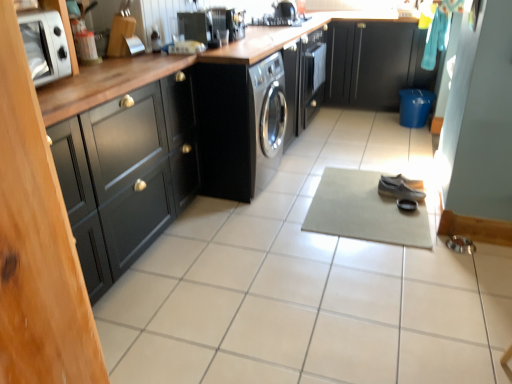
Where is `silver metallic microwave at upper left`? The height and width of the screenshot is (384, 512). silver metallic microwave at upper left is located at coordinates (45, 46).

Where is `leather shoe at center, arranged as the first shoe when viewed from the front`? leather shoe at center, arranged as the first shoe when viewed from the front is located at coordinates (398, 188).

Find the location of `black glossy stove at upper center`. black glossy stove at upper center is located at coordinates (278, 20).

The height and width of the screenshot is (384, 512). Find the location of `black matte cabinet at left, which is counted as the first cabinetry, starting from the left`. black matte cabinet at left, which is counted as the first cabinetry, starting from the left is located at coordinates (127, 174).

Find the location of `satin black washing machine at center`. satin black washing machine at center is located at coordinates (240, 126).

This screenshot has height=384, width=512. What are the coordinates of `silver metallic microwave at upper left` in the screenshot? It's located at click(x=45, y=46).

Which of these two, black matte cabinet at left, the 2th cabinetry positioned from the right, or black glossy stove at upper center, is bigger?

black matte cabinet at left, the 2th cabinetry positioned from the right.

Does black matte cabinet at left, the 2th cabinetry positioned from the right, have a greater width compared to black glossy stove at upper center?

Correct, the width of black matte cabinet at left, the 2th cabinetry positioned from the right, exceeds that of black glossy stove at upper center.

From the image's perspective, does black matte cabinet at left, positioned as the 1th cabinetry in front-to-back order, appear higher than black glossy stove at upper center?

No, from the image's perspective, black matte cabinet at left, positioned as the 1th cabinetry in front-to-back order, is not on top of black glossy stove at upper center.

Looking at this image, between black matte cabinet at left, which is counted as the first cabinetry, starting from the left, and black glossy stove at upper center, which one has more height?

black matte cabinet at left, which is counted as the first cabinetry, starting from the left.

Is silver metallic microwave at upper left closer to camera compared to black matte cabinet at left, the first cabinetry ordered from the bottom?

No, it is behind black matte cabinet at left, the first cabinetry ordered from the bottom.

This screenshot has width=512, height=384. I want to click on home appliance that appears above the black matte cabinet at left, the first cabinetry ordered from the bottom (from the image's perspective), so click(45, 46).

Looking at this image, is silver metallic microwave at upper left bigger than black matte cabinet at left, which is counted as the 2th cabinetry, starting from the back?

No.

Is black matte cabinet at left, the 2th cabinetry in the top-to-bottom sequence, next to white ceramic tile at center?

They are not placed beside each other.

Is black matte cabinet at left, which is counted as the first cabinetry, starting from the left, facing away from white ceramic tile at center?

No, white ceramic tile at center is not at the back of black matte cabinet at left, which is counted as the first cabinetry, starting from the left.

From a real-world perspective, which is physically above, leather shoe at center, which ranks as the second shoe in back-to-front order, or black glossy stove at upper center?

black glossy stove at upper center.

The height and width of the screenshot is (384, 512). Identify the location of the 2nd shoe directly beneath the black glossy stove at upper center (from a real-world perspective). (398, 188).

Which object is closer to the camera, leather shoe at center, arranged as the first shoe when viewed from the front, or black glossy stove at upper center?

leather shoe at center, arranged as the first shoe when viewed from the front, is more forward.

Does black glossy stove at upper center lie in front of leather shoe at center, which ranks as the second shoe in back-to-front order?

No, it is not.

Could leather shoe at center, arranged as the first shoe when viewed from the front, be considered to be inside black glossy stove at upper center?

Actually, leather shoe at center, arranged as the first shoe when viewed from the front, is outside black glossy stove at upper center.

Is black glossy stove at upper center wider or thinner than leather shoe at center, arranged as the first shoe when viewed from the front?

black glossy stove at upper center is wider than leather shoe at center, arranged as the first shoe when viewed from the front.

Which point is more distant from viewer, (221, 43) or (60, 59)?

The point (221, 43) is behind.

Which is more to the right, satin black coffee maker at upper center or silver metallic microwave at upper left?

Positioned to the right is satin black coffee maker at upper center.

In the image, there is a satin black coffee maker at upper center. Where is `home appliance below it (from the image's perspective)`? The width and height of the screenshot is (512, 384). home appliance below it (from the image's perspective) is located at coordinates (45, 46).

Considering the sizes of objects black glossy stove at upper center and satin black coffee maker at upper center in the image provided, who is bigger, black glossy stove at upper center or satin black coffee maker at upper center?

Bigger between the two is black glossy stove at upper center.

From a real-world perspective, which is physically below, black glossy stove at upper center or satin black coffee maker at upper center?

black glossy stove at upper center.

Identify the location of appliance below the black glossy stove at upper center (from the image's perspective). (206, 26).

Are black glossy stove at upper center and satin black coffee maker at upper center located far from each other?

black glossy stove at upper center is near satin black coffee maker at upper center, not far away.

From the image's perspective, starting from the black glossy stove at upper center, which cabinetry is the 2nd one below? Please provide its 2D coordinates.

[(127, 174)]

Where is `cabinetry in front of the silver metallic microwave at upper left`? cabinetry in front of the silver metallic microwave at upper left is located at coordinates (127, 174).

Looking at this image, based on their spatial positions, is leather at center, the second shoe viewed from the front, or white ceramic tile at center closer to satin black coffee maker at upper center?

white ceramic tile at center.

Looking at the image, which one is located closer to black matte cabinet at upper right, the first cabinetry when ordered from top to bottom, white ceramic tile at center or black glossy stove at upper center?

black glossy stove at upper center lies closer to black matte cabinet at upper right, the first cabinetry when ordered from top to bottom, than the other object.

Estimate the real-world distances between objects in this image. Which object is closer to beige fabric yoga mat at center, silver metallic microwave at upper left or black glossy stove at upper center?

Among the two, black glossy stove at upper center is located nearer to beige fabric yoga mat at center.

Based on their spatial positions, is leather at center, positioned as the first shoe in back-to-front order, or leather shoe at center, which ranks as the second shoe in back-to-front order, closer to satin black washing machine at center?

leather shoe at center, which ranks as the second shoe in back-to-front order, is positioned closer to the anchor satin black washing machine at center.

Based on their spatial positions, is beige fabric yoga mat at center or satin black washing machine at center further from satin black coffee maker at upper center?

beige fabric yoga mat at center.

Looking at the image, which one is located closer to satin black washing machine at center, white ceramic tile at center or satin black coffee maker at upper center?

The object closer to satin black washing machine at center is satin black coffee maker at upper center.

Estimate the real-world distances between objects in this image. Which object is further from silver metallic microwave at upper left, black matte cabinet at left, positioned as the 1th cabinetry in front-to-back order, or satin black washing machine at center?

satin black washing machine at center is further to silver metallic microwave at upper left.

Looking at this image, considering their positions, is silver metallic microwave at upper left positioned further to black glossy stove at upper center than black matte cabinet at upper right, the first cabinetry viewed from the back?

silver metallic microwave at upper left is further to black glossy stove at upper center.

You are a GUI agent. You are given a task and a screenshot of the screen. Output one action in this format:
    pyautogui.click(x=<x>, y=<y>)
    Task: Click on the shoe located between satin black washing machine at center and leather at center, the second shoe viewed from the front, in the left-right direction
    
    Given the screenshot: What is the action you would take?
    pyautogui.click(x=398, y=188)

Locate an element on the screen. The image size is (512, 384). appliance between white ceramic tile at center and black glossy stove at upper center along the z-axis is located at coordinates (206, 26).

At what (x,y) coordinates should I click in order to perform the action: click on ceramic tile located between silver metallic microwave at upper left and beige fabric yoga mat at center in the left-right direction. Please return your answer as a coordinate pair (x, y). Looking at the image, I should click on (309, 285).

Identify the location of washing machine positioned between black matte cabinet at left, positioned as the 1th cabinetry in front-to-back order, and black glossy stove at upper center from near to far. The height and width of the screenshot is (384, 512). (240, 126).